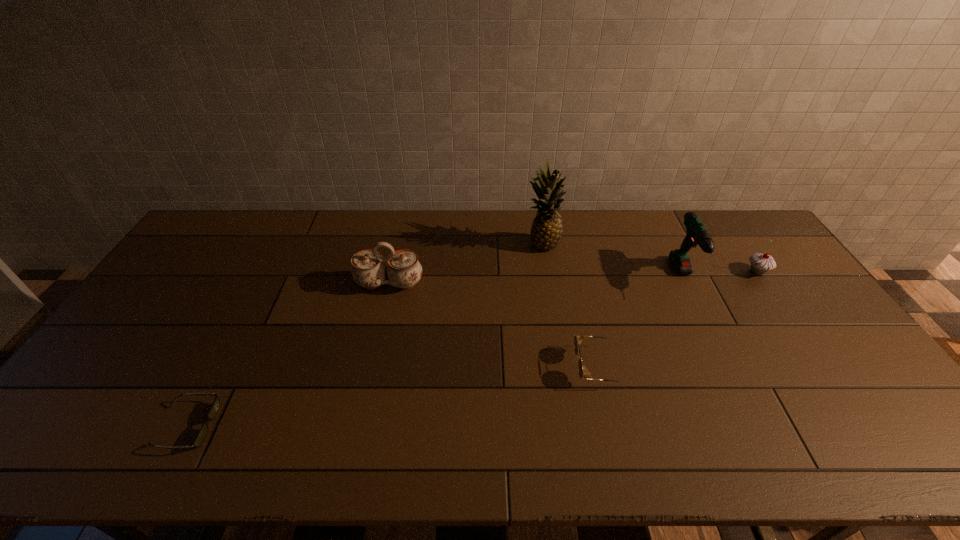
Image resolution: width=960 pixels, height=540 pixels. Identify the location of blank space that satisfies the following two spatial constraints: 1. on the handle side of the drill; 2. on the front lenses of the second shortest object. (730, 367).

The width and height of the screenshot is (960, 540). Find the location of `vacant region that satisfies the following two spatial constraints: 1. on the handle side of the second tallest object; 2. on the front-facing side of the shortest object`. vacant region that satisfies the following two spatial constraints: 1. on the handle side of the second tallest object; 2. on the front-facing side of the shortest object is located at coordinates (758, 426).

Identify the location of free point that satisfies the following two spatial constraints: 1. on the handle side of the second object from right to left; 2. on the front-facing side of the nearer sunglasses. (758, 426).

Locate an element on the screen. This screenshot has height=540, width=960. vacant region that satisfies the following two spatial constraints: 1. on the handle side of the fifth shortest object; 2. on the front lenses of the second shortest object is located at coordinates (730, 367).

Image resolution: width=960 pixels, height=540 pixels. I want to click on vacant space that satisfies the following two spatial constraints: 1. on the handle side of the drill; 2. on the front-facing side of the left sunglasses, so click(758, 426).